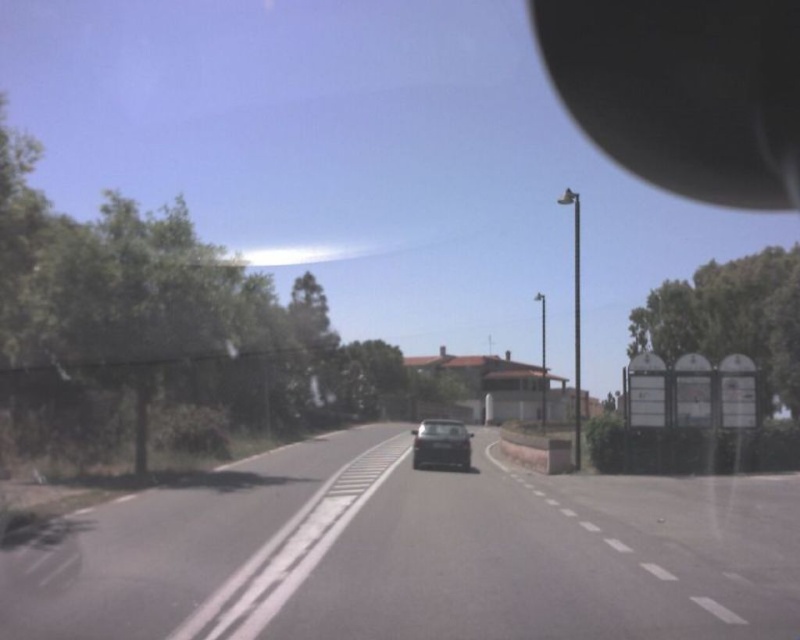
Question: Does black asphalt road at center have a lesser width compared to black rubber view mirror at upper right?

Choices:
 (A) yes
 (B) no

Answer: (A)

Question: Which point appears closest to the camera in this image?

Choices:
 (A) (572, 96)
 (B) (492, 525)
 (C) (440, 442)

Answer: (B)

Question: Is black asphalt road at center below satin black car at center?

Choices:
 (A) yes
 (B) no

Answer: (B)

Question: Is black asphalt road at center thinner than black rubber view mirror at upper right?

Choices:
 (A) yes
 (B) no

Answer: (A)

Question: Which of the following is the farthest from the observer?

Choices:
 (A) (285, 516)
 (B) (426, 460)

Answer: (B)

Question: Which is nearer to the black rubber view mirror at upper right?

Choices:
 (A) black asphalt road at center
 (B) satin black car at center

Answer: (B)